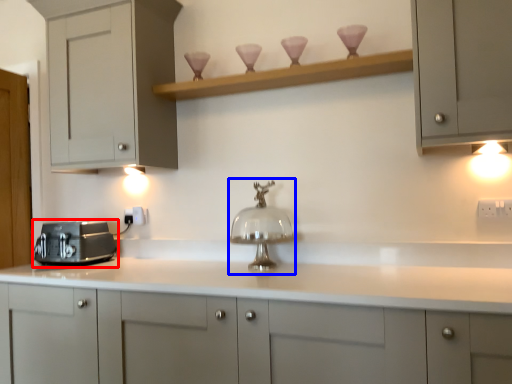
Question: Which point is closer to the camera, home appliance (highlighted by a red box) or faucet (highlighted by a blue box)?

Choices:
 (A) home appliance
 (B) faucet

Answer: (B)